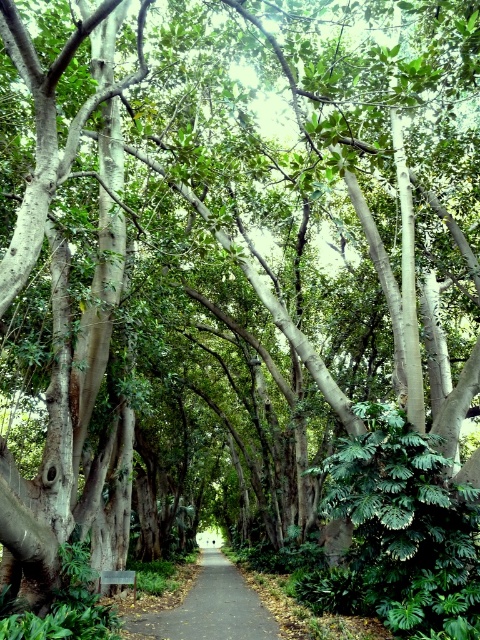
You are standing on the pathway and see two points marked on the ground ahead of you. The first point is at coordinates point (210, 548) and the second point is at point (133, 589). Which point is closer to your current position?

Point (210, 548) is closer to your current position because it is further to the viewer than point (133, 589), meaning it is nearer to you.